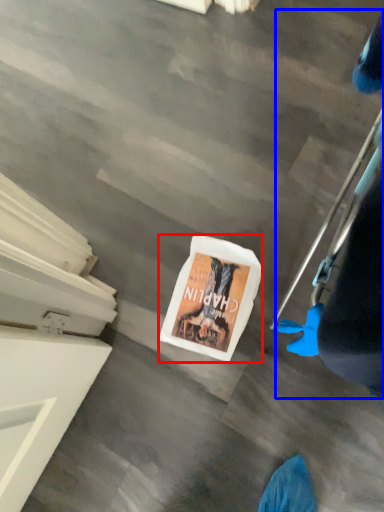
Question: Which point is further to the camera, magazine (highlighted by a red box) or person (highlighted by a blue box)?

Choices:
 (A) magazine
 (B) person

Answer: (A)